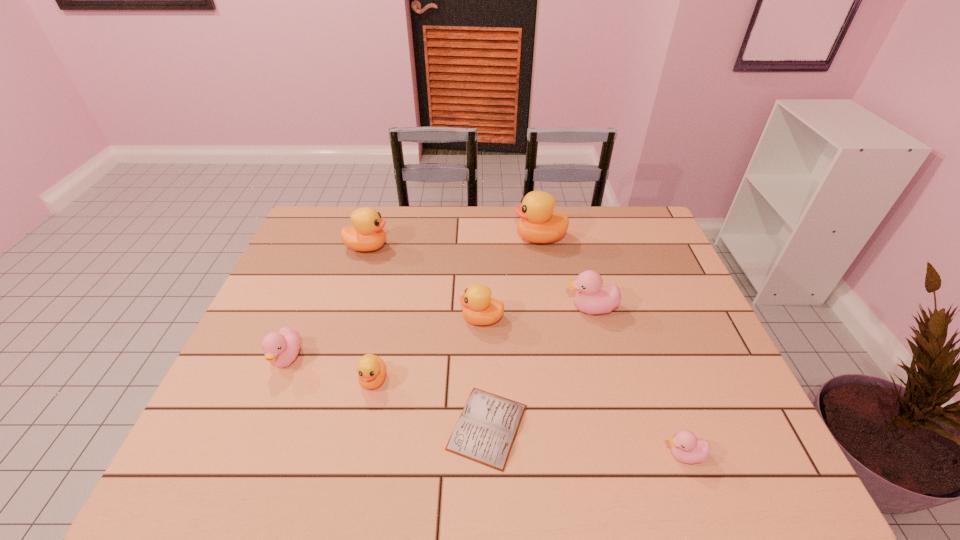
The height and width of the screenshot is (540, 960). In order to click on the biggest yellow duckling in this screenshot , I will do `click(538, 223)`.

Where is `the rightmost yellow duckling`? The image size is (960, 540). the rightmost yellow duckling is located at coordinates (538, 223).

Locate an element on the screen. This screenshot has height=540, width=960. the leftmost yellow duckling is located at coordinates (366, 234).

At what (x,y) coordinates should I click in order to perform the action: click on the third smallest yellow duckling. Please return your answer as a coordinate pair (x, y). The height and width of the screenshot is (540, 960). Looking at the image, I should click on (366, 234).

I want to click on the biggest pink duckling, so click(x=592, y=298).

Identify the location of the third biggest yellow duckling. (479, 308).

Where is `the third farthest yellow duckling`? The image size is (960, 540). the third farthest yellow duckling is located at coordinates (479, 308).

You are a GUI agent. You are given a task and a screenshot of the screen. Output one action in this format:
    pyautogui.click(x=<x>, y=<y>)
    Task: Click on the second nearest pink duckling
    The height and width of the screenshot is (540, 960).
    Given the screenshot: What is the action you would take?
    pyautogui.click(x=281, y=348)

Where is `the second smallest pink duckling`? the second smallest pink duckling is located at coordinates (281, 348).

This screenshot has width=960, height=540. In order to click on the nearest yellow duckling in this screenshot , I will do `click(371, 369)`.